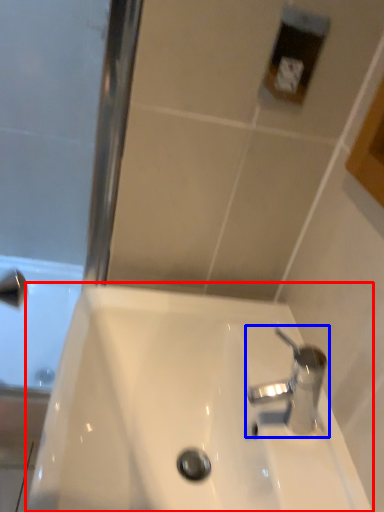
Question: Which point is closer to the camera, sink (highlighted by a red box) or tap (highlighted by a blue box)?

Choices:
 (A) sink
 (B) tap

Answer: (A)